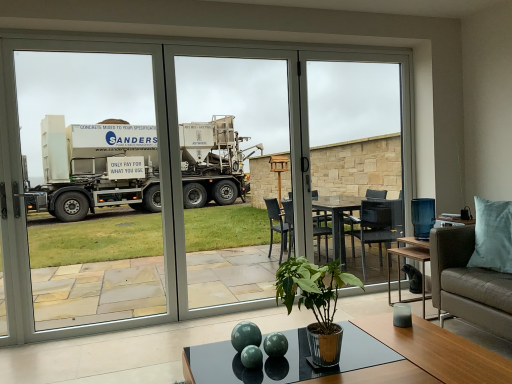
In order to click on transparent glass door at left, the 2th screen door in the right-to-left sequence in this screenshot , I will do pyautogui.click(x=84, y=189).

What do you see at coordinates (476, 269) in the screenshot?
I see `brown leather couch at lower right` at bounding box center [476, 269].

The width and height of the screenshot is (512, 384). What do you see at coordinates (358, 145) in the screenshot? I see `transparent glass table at center` at bounding box center [358, 145].

Describe the element at coordinates (185, 172) in the screenshot. I see `transparent glass door at center` at that location.

Identify the location of green glossy plant at center. This screenshot has height=384, width=512. (316, 303).

Is brown leather couch at lower right positioned with its back to matte black coffee table at center?

That's not correct — brown leather couch at lower right is not looking away from matte black coffee table at center.

In the scene shown: Considering the sizes of objects brown leather couch at lower right and matte black coffee table at center in the image provided, who is wider, brown leather couch at lower right or matte black coffee table at center?

brown leather couch at lower right is wider.

Is transparent glass door at center looking in the opposite direction of transparent glass door at left, which ranks as the first screen door in left-to-right order?

That's right, transparent glass door at center is facing away from transparent glass door at left, which ranks as the first screen door in left-to-right order.

You are a GUI agent. You are given a task and a screenshot of the screen. Output one action in this format:
    pyautogui.click(x=<x>, y=<y>)
    Task: Click on the door located underneath the transparent glass door at left, which ranks as the first screen door in left-to-right order (from a real-world perspective)
    
    Given the screenshot: What is the action you would take?
    pyautogui.click(x=185, y=172)

Can you confirm if transparent glass door at center is bigger than transparent glass door at left, the 2th screen door in the right-to-left sequence?

Indeed, transparent glass door at center has a larger size compared to transparent glass door at left, the 2th screen door in the right-to-left sequence.

The image size is (512, 384). Identify the location of houseplant lying above the matte black coffee table at center (from the image's perspective). [x=316, y=303].

From a real-world perspective, which is physically above, green glossy plant at center or matte black coffee table at center?

In real-world perspective, green glossy plant at center is above.

Between green glossy plant at center and matte black coffee table at center, which one has smaller width?

green glossy plant at center.

Is green glossy plant at center in front of or behind matte black coffee table at center in the image?

green glossy plant at center is behind matte black coffee table at center.

From the image's perspective, is transparent glass door at left, which ranks as the first screen door in left-to-right order, located above or below transparent glass table at center?

Based on their image positions, transparent glass door at left, which ranks as the first screen door in left-to-right order, is located beneath transparent glass table at center.

In terms of size, does transparent glass door at left, which ranks as the first screen door in left-to-right order, appear bigger or smaller than transparent glass table at center?

In the image, transparent glass door at left, which ranks as the first screen door in left-to-right order, appears to be larger than transparent glass table at center.

Does transparent glass door at left, the 2th screen door in the right-to-left sequence, appear on the left side of transparent glass table at center?

Yes.

Between transparent glass door at center and transparent glass table at center, which one appears on the right side from the viewer's perspective?

transparent glass table at center is more to the right.

Is transparent glass door at center next to transparent glass table at center and touching it?

There is a gap between transparent glass door at center and transparent glass table at center.

Does transparent glass door at center have a greater width compared to transparent glass table at center?

Indeed, transparent glass door at center has a greater width compared to transparent glass table at center.

Is transparent glass door at center situated inside transparent glass table at center or outside?

transparent glass door at center cannot be found inside transparent glass table at center.

Can you confirm if matte black coffee table at center is thinner than transparent glass door at left, the 2th screen door in the right-to-left sequence?

No.

Which is further, (233, 357) or (63, 179)?

The point (63, 179) is farther from the camera.

In the scene shown: Which of these two, matte black coffee table at center or transparent glass door at left, the 2th screen door in the right-to-left sequence, is smaller?

With smaller size is matte black coffee table at center.

Can you confirm if matte black coffee table at center is positioned to the right of transparent glass door at left, the 2th screen door in the right-to-left sequence?

Indeed, matte black coffee table at center is positioned on the right side of transparent glass door at left, the 2th screen door in the right-to-left sequence.

Considering the relative positions of green glossy plant at center and transparent glass table at center in the image provided, is green glossy plant at center behind transparent glass table at center?

No, green glossy plant at center is closer to the camera.

Is green glossy plant at center smaller than transparent glass table at center?

Correct, green glossy plant at center occupies less space than transparent glass table at center.

Between green glossy plant at center and transparent glass table at center, which one has less height?

green glossy plant at center is shorter.

Is green glossy plant at center inside or outside of transparent glass table at center?

green glossy plant at center is located beyond the bounds of transparent glass table at center.

Where is `studio couch to the right of matte black coffee table at center`? The height and width of the screenshot is (384, 512). studio couch to the right of matte black coffee table at center is located at coordinates (476, 269).

From the image's perspective, count 1st screen doors upward from the transparent glass door at center and point to it. Please provide its 2D coordinates.

[(84, 189)]

From the image, which object appears to be nearer to transparent glass door at center, transparent glass door at left, which ranks as the first screen door in left-to-right order, or transparent glass table at center?

Based on the image, transparent glass table at center appears to be nearer to transparent glass door at center.

When comparing their distances from transparent glass door at center, the first screen door viewed from the right, does brown leather couch at lower right or transparent glass door at center seem closer?

The object closer to transparent glass door at center, the first screen door viewed from the right, is transparent glass door at center.

When comparing their distances from green glossy plant at center, does transparent glass door at left, which ranks as the first screen door in left-to-right order, or transparent glass door at center, the first screen door viewed from the right, seem further?

Among the two, transparent glass door at left, which ranks as the first screen door in left-to-right order, is located further to green glossy plant at center.

Looking at the image, which one is located further to green glossy plant at center, transparent glass table at center or brown leather couch at lower right?

transparent glass table at center is positioned further to the anchor green glossy plant at center.

Which object lies nearer to the anchor point transparent glass door at center, transparent glass door at left, which ranks as the first screen door in left-to-right order, or green glossy plant at center?

The object closer to transparent glass door at center is green glossy plant at center.

Estimate the real-world distances between objects in this image. Which object is further from transparent glass table at center, transparent glass door at center or green glossy plant at center?

Based on the image, green glossy plant at center appears to be further to transparent glass table at center.

Which object lies further to the anchor point transparent glass door at left, the 2th screen door in the right-to-left sequence, transparent glass table at center or transparent glass door at center?

transparent glass table at center is positioned further to the anchor transparent glass door at left, the 2th screen door in the right-to-left sequence.

Estimate the real-world distances between objects in this image. Which object is further from transparent glass door at center, brown leather couch at lower right or transparent glass table at center?

transparent glass table at center lies further to transparent glass door at center than the other object.

Find the location of `screen door between transparent glass door at left, the 2th screen door in the right-to-left sequence, and brown leather couch at lower right, in the horizontal direction`. screen door between transparent glass door at left, the 2th screen door in the right-to-left sequence, and brown leather couch at lower right, in the horizontal direction is located at coordinates click(x=249, y=115).

Find the location of a particular element. This screenshot has height=384, width=512. screen door between matte black coffee table at center and transparent glass door at center, the first screen door viewed from the right, from front to back is located at coordinates (84, 189).

Locate an element on the screen. The width and height of the screenshot is (512, 384). door between green glossy plant at center and transparent glass door at center, the second screen door positioned from the left, in the front-back direction is located at coordinates (185, 172).

Locate an element on the screen. The width and height of the screenshot is (512, 384). houseplant between matte black coffee table at center and transparent glass table at center from front to back is located at coordinates (316, 303).